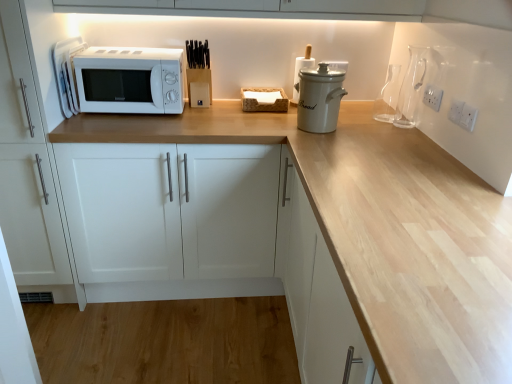
This screenshot has height=384, width=512. Find the location of `white ceramic crock at center, the third appliance in the left-to-right sequence`. white ceramic crock at center, the third appliance in the left-to-right sequence is located at coordinates (319, 99).

What do you see at coordinates (170, 210) in the screenshot? I see `white matte cabinet at center, the second cabinetry when ordered from left to right` at bounding box center [170, 210].

What do you see at coordinates (411, 88) in the screenshot? The height and width of the screenshot is (384, 512). I see `transparent glass carafe at upper right, arranged as the 4th appliance when viewed from the left` at bounding box center [411, 88].

This screenshot has width=512, height=384. Identify the location of white matte microwave at upper left, marked as the 1th appliance in a left-to-right arrangement. (67, 73).

What are the coordinates of `white ceramic crock at center, the 3th appliance positioned from the right` in the screenshot? It's located at (300, 69).

Locate an element on the screen. The height and width of the screenshot is (384, 512). white plastic electric outlet at upper right, which is the first electric outlet in front-to-back order is located at coordinates coord(468,117).

This screenshot has height=384, width=512. What do you see at coordinates (468, 117) in the screenshot?
I see `white plastic electric outlet at upper right, which is counted as the 1th electric outlet, starting from the bottom` at bounding box center [468, 117].

Where is `white ceramic crock at center, acting as the second appliance starting from the right`? This screenshot has width=512, height=384. white ceramic crock at center, acting as the second appliance starting from the right is located at coordinates (319, 99).

Is the position of white ceramic crock at center, the 3th appliance positioned from the right, less distant than that of white ceramic crock at center, the third appliance in the left-to-right sequence?

No, the depth of white ceramic crock at center, the 3th appliance positioned from the right, is greater than that of white ceramic crock at center, the third appliance in the left-to-right sequence.

Is white ceramic crock at center, which appears as the second appliance when viewed from the left, located outside white ceramic crock at center, acting as the second appliance starting from the right?

Yes, white ceramic crock at center, which appears as the second appliance when viewed from the left, is not within white ceramic crock at center, acting as the second appliance starting from the right.

From the image's perspective, is white ceramic crock at center, which appears as the second appliance when viewed from the left, positioned above or below white ceramic crock at center, the third appliance in the left-to-right sequence?

Clearly, from the image's perspective, white ceramic crock at center, which appears as the second appliance when viewed from the left, is above white ceramic crock at center, the third appliance in the left-to-right sequence.

Can you confirm if white ceramic crock at center, which appears as the second appliance when viewed from the left, is positioned to the right of white ceramic crock at center, the third appliance in the left-to-right sequence?

No, white ceramic crock at center, which appears as the second appliance when viewed from the left, is not to the right of white ceramic crock at center, the third appliance in the left-to-right sequence.

Is transparent glass carafe at upper right, the 1th appliance viewed from the right, positioned with its back to white ceramic crock at center, the third appliance in the left-to-right sequence?

No, transparent glass carafe at upper right, the 1th appliance viewed from the right,'s orientation is not away from white ceramic crock at center, the third appliance in the left-to-right sequence.

Consider the image. Is transparent glass carafe at upper right, arranged as the 4th appliance when viewed from the left, closer to camera compared to white ceramic crock at center, acting as the second appliance starting from the right?

No, it is behind white ceramic crock at center, acting as the second appliance starting from the right.

From a real-world perspective, who is located lower, transparent glass carafe at upper right, arranged as the 4th appliance when viewed from the left, or white ceramic crock at center, acting as the second appliance starting from the right?

From a 3D spatial view, white ceramic crock at center, acting as the second appliance starting from the right, is below.

Can you confirm if white matte microwave at left is thinner than white matte cabinet at center, the first cabinetry in the right-to-left sequence?

Yes, white matte microwave at left is thinner than white matte cabinet at center, the first cabinetry in the right-to-left sequence.

From a real-world perspective, does white matte microwave at left stand above white matte cabinet at center, the second cabinetry when ordered from left to right?

Yes, from a real-world perspective, white matte microwave at left is over white matte cabinet at center, the second cabinetry when ordered from left to right

What are the coordinates of `microwave oven located above the white matte cabinet at center, the second cabinetry when ordered from left to right (from the image's perspective)` in the screenshot? It's located at (129, 80).

From the image's perspective, would you say white matte microwave at upper left, which is the fourth appliance from right to left, is shown under white plastic electric outlet at upper right, which is the first electric outlet in front-to-back order?

No.

Is white matte microwave at upper left, marked as the 1th appliance in a left-to-right arrangement, positioned in front of white plastic electric outlet at upper right, arranged as the second electric outlet when viewed from the back?

No.

From a real-world perspective, which is physically below, white matte microwave at upper left, which is the fourth appliance from right to left, or white plastic electric outlet at upper right, which is the first electric outlet in front-to-back order?

white plastic electric outlet at upper right, which is the first electric outlet in front-to-back order, is physically lower.

Who is bigger, white matte microwave at upper left, marked as the 1th appliance in a left-to-right arrangement, or white plastic electric outlet at upper right, the second electric outlet in the top-to-bottom sequence?

With larger size is white matte microwave at upper left, marked as the 1th appliance in a left-to-right arrangement.

In terms of width, does white matte cabinet at left, the 2th cabinetry from the right, look wider or thinner when compared to white matte microwave at upper left, marked as the 1th appliance in a left-to-right arrangement?

In the image, white matte cabinet at left, the 2th cabinetry from the right, appears to be wider than white matte microwave at upper left, marked as the 1th appliance in a left-to-right arrangement.

Could you tell me if white matte cabinet at left, marked as the first cabinetry in a left-to-right arrangement, is turned towards white matte microwave at upper left, marked as the 1th appliance in a left-to-right arrangement?

No, white matte cabinet at left, marked as the first cabinetry in a left-to-right arrangement, is not oriented towards white matte microwave at upper left, marked as the 1th appliance in a left-to-right arrangement.

From the image's perspective, which is below, white matte cabinet at left, the 2th cabinetry from the right, or white matte microwave at upper left, marked as the 1th appliance in a left-to-right arrangement?

white matte cabinet at left, the 2th cabinetry from the right, from the image's perspective.

Is white matte cabinet at left, the 2th cabinetry from the right, inside the boundaries of white matte microwave at upper left, marked as the 1th appliance in a left-to-right arrangement, or outside?

white matte cabinet at left, the 2th cabinetry from the right, lies outside white matte microwave at upper left, marked as the 1th appliance in a left-to-right arrangement.

Is white plastic electric outlet at upper right, which is counted as the 1th electric outlet, starting from the bottom, positioned before white matte microwave at left?

That is True.

Does white plastic electric outlet at upper right, which is the first electric outlet in front-to-back order, contain white matte microwave at left?

No.

Considering the sizes of white plastic electric outlet at upper right, arranged as the second electric outlet when viewed from the back, and white matte microwave at left in the image, is white plastic electric outlet at upper right, arranged as the second electric outlet when viewed from the back, taller or shorter than white matte microwave at left?

In the image, white plastic electric outlet at upper right, arranged as the second electric outlet when viewed from the back, appears to be shorter than white matte microwave at left.

Between point (476, 116) and point (157, 88), which one is positioned behind?

Positioned behind is point (157, 88).

Based on the photo, from the image's perspective, which object appears higher, white plastic electric outlet at upper right, which is the first electric outlet in front-to-back order, or white matte cabinet at center, the second cabinetry when ordered from left to right?

white plastic electric outlet at upper right, which is the first electric outlet in front-to-back order, from the image's perspective.

Does white plastic electric outlet at upper right, which is counted as the 1th electric outlet, starting from the bottom, have a greater height compared to white matte cabinet at center, the second cabinetry when ordered from left to right?

No, white plastic electric outlet at upper right, which is counted as the 1th electric outlet, starting from the bottom, is not taller than white matte cabinet at center, the second cabinetry when ordered from left to right.

In terms of width, does white plastic electric outlet at upper right, which is counted as the 1th electric outlet, starting from the bottom, look wider or thinner when compared to white matte cabinet at center, the second cabinetry when ordered from left to right?

In the image, white plastic electric outlet at upper right, which is counted as the 1th electric outlet, starting from the bottom, appears to be more narrow than white matte cabinet at center, the second cabinetry when ordered from left to right.

At what (x,y) coordinates should I click in order to perform the action: click on the 3rd appliance behind the white ceramic crock at center, acting as the second appliance starting from the right. Please return your answer as a coordinate pair (x, y). Looking at the image, I should click on pos(300,69).

Find the location of a particular element. The height and width of the screenshot is (384, 512). appliance that is below the transparent glass carafe at upper right, the 1th appliance viewed from the right (from the image's perspective) is located at coordinates (319, 99).

When comparing their distances from white matte microwave at left, does white matte cabinet at left, the 2th cabinetry from the right, or transparent glass carafe at upper right seem further?

transparent glass carafe at upper right is further to white matte microwave at left.

Considering their positions, is white matte microwave at upper left, marked as the 1th appliance in a left-to-right arrangement, positioned further to white ceramic crock at center, the 3th appliance positioned from the right, than white plastic electric outlet at upper right, the 1th electric outlet from the back?

white matte microwave at upper left, marked as the 1th appliance in a left-to-right arrangement, lies further to white ceramic crock at center, the 3th appliance positioned from the right, than the other object.

Considering their positions, is transparent glass carafe at upper right, the 1th appliance viewed from the right, positioned further to white matte microwave at upper left, which is the fourth appliance from right to left, than transparent glass carafe at upper right?

Based on the image, transparent glass carafe at upper right, the 1th appliance viewed from the right, appears to be further to white matte microwave at upper left, which is the fourth appliance from right to left.

Consider the image. Which object lies further to the anchor point white matte microwave at upper left, which is the fourth appliance from right to left, white ceramic crock at center, the 3th appliance positioned from the right, or white matte cabinet at center, the second cabinetry when ordered from left to right?

white ceramic crock at center, the 3th appliance positioned from the right, is positioned further to the anchor white matte microwave at upper left, which is the fourth appliance from right to left.

Considering their positions, is transparent glass carafe at upper right positioned further to white matte cabinet at center, the first cabinetry in the right-to-left sequence, than transparent glass carafe at upper right, arranged as the 4th appliance when viewed from the left?

The object further to white matte cabinet at center, the first cabinetry in the right-to-left sequence, is transparent glass carafe at upper right, arranged as the 4th appliance when viewed from the left.

From the image, which object appears to be farther from white plastic electric outlet at upper right, arranged as the second electric outlet when viewed from the back, white matte cabinet at left, the 2th cabinetry from the right, or white matte microwave at upper left, which is the fourth appliance from right to left?

Among the two, white matte cabinet at left, the 2th cabinetry from the right, is located further to white plastic electric outlet at upper right, arranged as the second electric outlet when viewed from the back.

When comparing their distances from white ceramic crock at center, which appears as the second appliance when viewed from the left, does transparent glass carafe at upper right or white plastic electric outlet at upper right, which is the 2th electric outlet in front-to-back order, seem closer?

transparent glass carafe at upper right is closer to white ceramic crock at center, which appears as the second appliance when viewed from the left.

Looking at the image, which one is located closer to white plastic electric outlet at upper right, the 1th electric outlet from the back, white ceramic crock at center, the third appliance in the left-to-right sequence, or white matte cabinet at center, the first cabinetry in the right-to-left sequence?

Based on the image, white ceramic crock at center, the third appliance in the left-to-right sequence, appears to be nearer to white plastic electric outlet at upper right, the 1th electric outlet from the back.

Identify the location of cabinetry situated between white matte microwave at upper left, which is the fourth appliance from right to left, and white plastic electric outlet at upper right, the second electric outlet in the top-to-bottom sequence, from left to right. The width and height of the screenshot is (512, 384). (170, 210).

You are a GUI agent. You are given a task and a screenshot of the screen. Output one action in this format:
    pyautogui.click(x=<x>, y=<y>)
    Task: Click on the microwave oven between white matte cabinet at left, the 2th cabinetry from the right, and transparent glass carafe at upper right, the 1th appliance viewed from the right, in the horizontal direction
    This screenshot has height=384, width=512.
    Given the screenshot: What is the action you would take?
    pyautogui.click(x=129, y=80)

Where is `microwave oven situated between white matte cabinet at left, the 2th cabinetry from the right, and white matte cabinet at center, the first cabinetry in the right-to-left sequence, from left to right`? microwave oven situated between white matte cabinet at left, the 2th cabinetry from the right, and white matte cabinet at center, the first cabinetry in the right-to-left sequence, from left to right is located at coordinates (129, 80).

Locate an element on the screen. Image resolution: width=512 pixels, height=384 pixels. appliance between white plastic electric outlet at upper right, which is the 2th electric outlet in front-to-back order, and transparent glass carafe at upper right in the front-back direction is located at coordinates (411, 88).